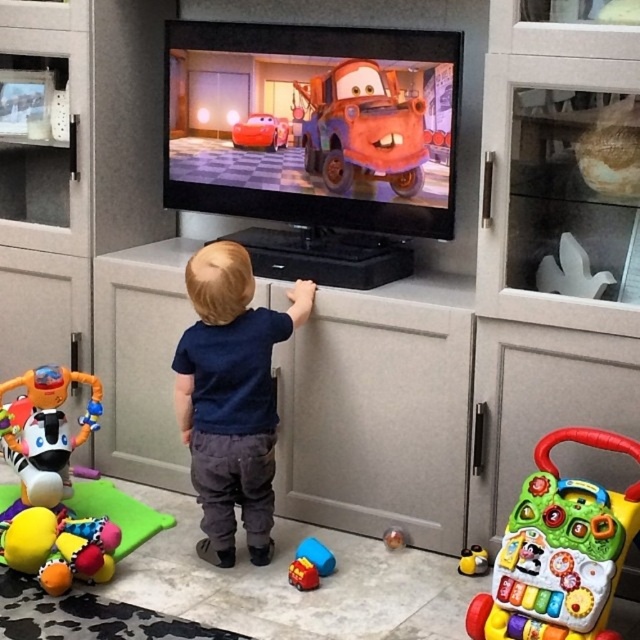
Question: Estimate the real-world distances between objects in this image. Which object is closer to the multicolored plastic walker at lower right?

Choices:
 (A) plush multicolored baby toy at lower left
 (B) shiny red toy car at center

Answer: (A)

Question: Does multicolored plastic walker at lower right appear under matte blue truck at center?

Choices:
 (A) yes
 (B) no

Answer: (A)

Question: Considering the real-world distances, which object is closest to the dark blue shirt at center?

Choices:
 (A) rubberized plastic toy at lower right
 (B) rubberized plastic toy at lower center
 (C) shiny red toy car at center
 (D) rubberized plastic ball at center

Answer: (B)

Question: Does multicolored plastic walker at lower right appear over rubberized plastic toy at lower center?

Choices:
 (A) yes
 (B) no

Answer: (A)

Question: Which of the following is the closest to the observer?

Choices:
 (A) rubberized plastic ball at center
 (B) dark blue shirt at center
 (C) matte blue truck at center
 (D) rubberized plastic toy at lower right

Answer: (B)

Question: Is dark blue shirt at center thinner than multicolored plastic walker at lower right?

Choices:
 (A) no
 (B) yes

Answer: (B)